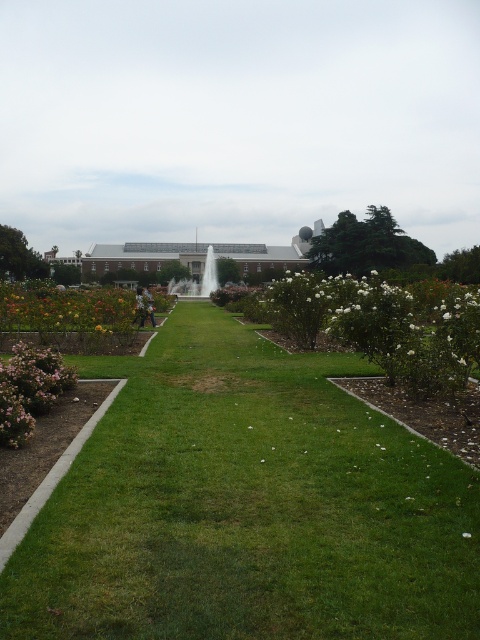
Question: Which object is the farthest from the pink matte bush at lower left?

Choices:
 (A) white marble fountain at center
 (B) green grass at center

Answer: (A)

Question: In this image, where is white matte bush at center-right located relative to pink matte bush at lower left?

Choices:
 (A) below
 (B) above

Answer: (B)

Question: Where is green grass at center located in relation to white matte bush at center-right in the image?

Choices:
 (A) below
 (B) above

Answer: (A)

Question: Based on their relative distances, which object is nearer to the white marble fountain at center?

Choices:
 (A) green grass at center
 (B) white matte bush at center-right

Answer: (B)

Question: Is pink matte bush at lower left thinner than white marble fountain at center?

Choices:
 (A) no
 (B) yes

Answer: (B)

Question: Which of the following is the farthest from the observer?

Choices:
 (A) (417, 394)
 (B) (216, 284)

Answer: (B)